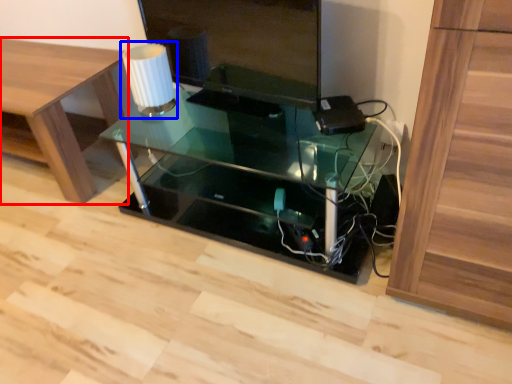
Question: Which point is closer to the camera, furniture (highlighted by a red box) or table lamp (highlighted by a blue box)?

Choices:
 (A) furniture
 (B) table lamp

Answer: (B)